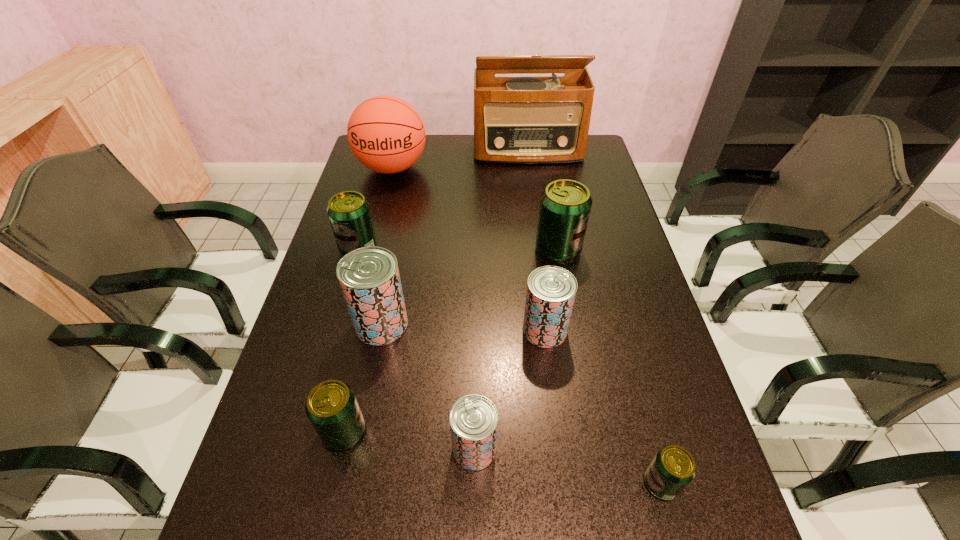
Where is `radio receiver that is at the far edge`? radio receiver that is at the far edge is located at coordinates (541, 119).

The height and width of the screenshot is (540, 960). I want to click on basketball that is at the far edge, so click(x=386, y=134).

Where is `basketball that is at the left edge`? basketball that is at the left edge is located at coordinates (386, 134).

Find the location of a particular element. This screenshot has height=540, width=960. radio receiver that is positioned at the right edge is located at coordinates (541, 119).

This screenshot has width=960, height=540. What are the coordinates of `object located in the far left corner section of the desktop` in the screenshot? It's located at (386, 134).

This screenshot has width=960, height=540. In order to click on object positioned at the far right corner in this screenshot , I will do `click(541, 119)`.

The image size is (960, 540). I want to click on vacant region at the far edge of the desktop, so click(462, 158).

In the image, there is a desktop. Identify the location of vacant space at the left edge. (309, 300).

I want to click on blank space at the right edge of the desktop, so click(x=607, y=238).

The height and width of the screenshot is (540, 960). Identify the location of vacant point located between the third biggest green beer can and the tallest object. (436, 291).